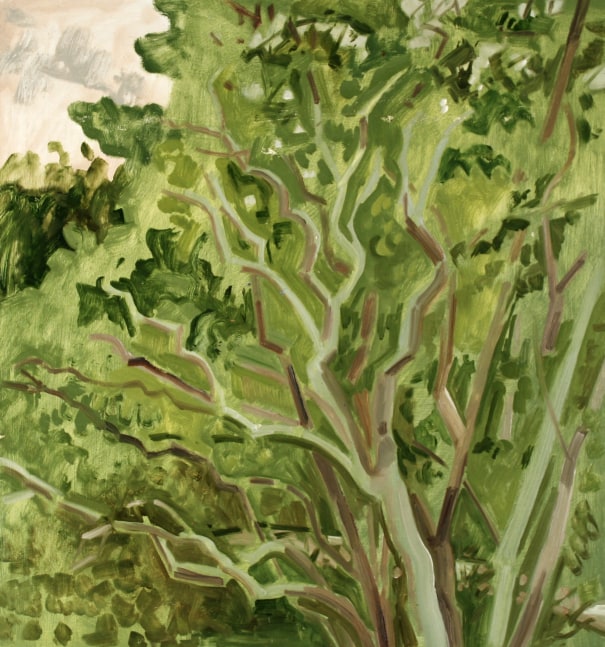
At what (x,y) coordinates should I click in order to perform the action: click on dark brown paint. Please return your answer as a coordinate pair (x, y). Looking at the image, I should click on (564, 72), (315, 92), (381, 622), (446, 514).